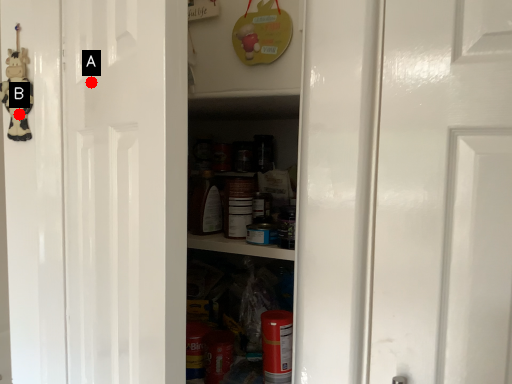
Question: Two points are circled on the image, labeled by A and B beside each circle. Which point is closer to the camera?

Choices:
 (A) A is closer
 (B) B is closer

Answer: (A)